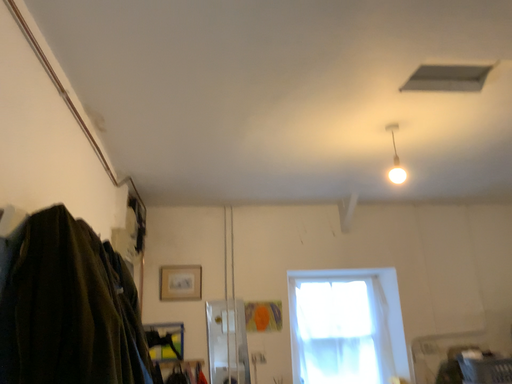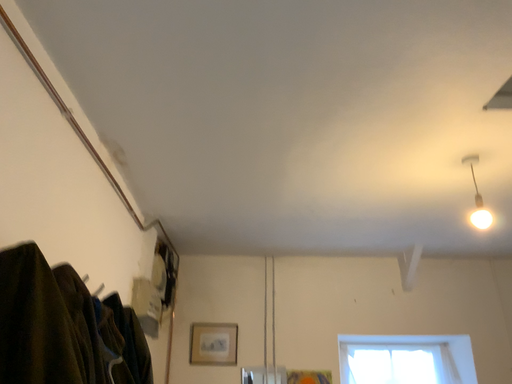
Question: How did the camera likely rotate when shooting the video?

Choices:
 (A) rotated upward
 (B) rotated downward

Answer: (A)